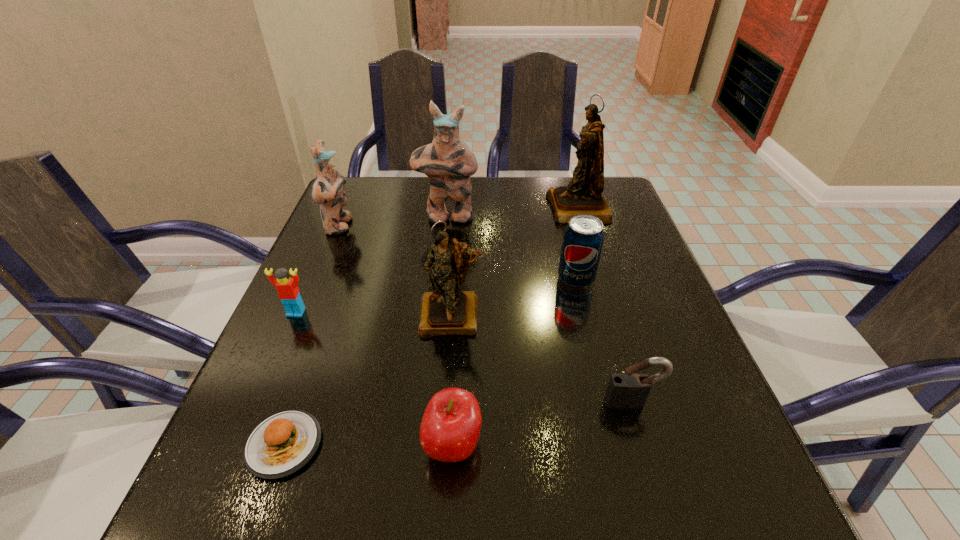
At what (x,y) coordinates should I click in order to perform the action: click on the right gold figurine. Please return your answer as a coordinate pair (x, y). The width and height of the screenshot is (960, 540). Looking at the image, I should click on (583, 195).

What are the coordinates of `the farther gold figurine` in the screenshot? It's located at (583, 195).

The width and height of the screenshot is (960, 540). Find the location of `the bigger pink figurine`. the bigger pink figurine is located at coordinates (448, 162).

The width and height of the screenshot is (960, 540). I want to click on the smaller pink figurine, so click(327, 191).

At what (x,y) coordinates should I click in order to perform the action: click on the leftmost figurine. Please return your answer as a coordinate pair (x, y). Image resolution: width=960 pixels, height=540 pixels. Looking at the image, I should click on (327, 191).

Where is `the nearest figurine`? the nearest figurine is located at coordinates (446, 311).

Find the location of a particular element. The image size is (960, 540). the nearer gold figurine is located at coordinates (446, 311).

Locate an element on the screen. The height and width of the screenshot is (540, 960). soda can is located at coordinates (583, 238).

Identify the location of the fifth shortest object. Image resolution: width=960 pixels, height=540 pixels. (583, 238).

At what (x,y) coordinates should I click in order to perform the action: click on Lego. Please return your answer as a coordinate pair (x, y). Looking at the image, I should click on [287, 288].